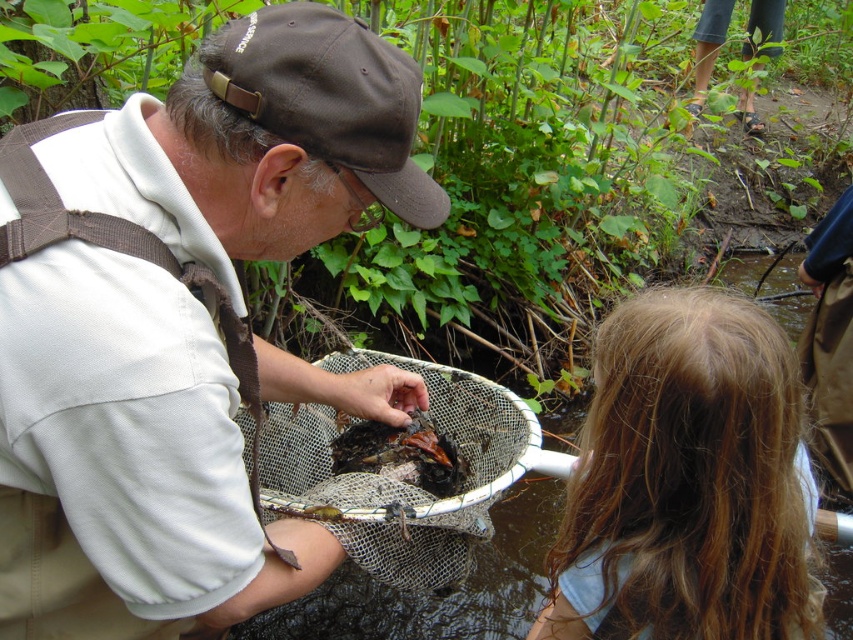
Who is higher up, brown fabric hat at upper center or blonde hair at upper right?

brown fabric hat at upper center

In order to click on brown fabric hat at upper center in this screenshot , I will do `click(183, 323)`.

Is blonde hair at upper right to the left of brown fabric cap at upper center from the viewer's perspective?

Incorrect, blonde hair at upper right is not on the left side of brown fabric cap at upper center.

Can you confirm if blonde hair at upper right is shorter than brown fabric cap at upper center?

In fact, blonde hair at upper right may be taller than brown fabric cap at upper center.

This screenshot has height=640, width=853. What are the coordinates of `blonde hair at upper right` in the screenshot? It's located at (688, 481).

Where is `blonde hair at upper right`? blonde hair at upper right is located at coordinates (688, 481).

Who is taller, brown fabric hat at upper center or brown fabric cap at upper center?

brown fabric hat at upper center is taller.

Is brown fabric hat at upper center to the left of brown fabric cap at upper center from the viewer's perspective?

Yes, brown fabric hat at upper center is to the left of brown fabric cap at upper center.

Find the location of `brown fabric hat at upper center`. brown fabric hat at upper center is located at coordinates (183, 323).